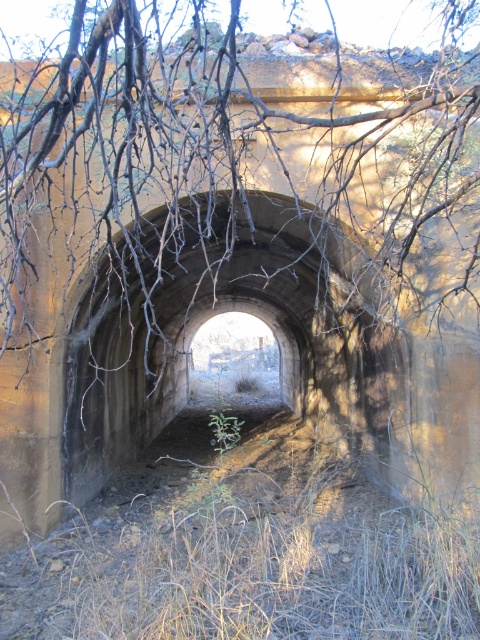
Question: Which object is the closest to the green fuzzy plant at center?

Choices:
 (A) concrete tunnel at center
 (B) brown dry branches at upper center

Answer: (A)

Question: Does brown dry branches at upper center come in front of concrete tunnel at center?

Choices:
 (A) yes
 (B) no

Answer: (A)

Question: Which point is closer to the camera?

Choices:
 (A) green fuzzy plant at center
 (B) concrete tunnel at center
 (C) brown dry branches at upper center

Answer: (C)

Question: Which of these objects is positioned closest to the brown dry branches at upper center?

Choices:
 (A) concrete tunnel at center
 (B) green fuzzy plant at center

Answer: (A)

Question: Can you confirm if brown dry branches at upper center is bigger than green fuzzy plant at center?

Choices:
 (A) yes
 (B) no

Answer: (B)

Question: In this image, where is brown dry branches at upper center located relative to concrete tunnel at center?

Choices:
 (A) right
 (B) left

Answer: (A)